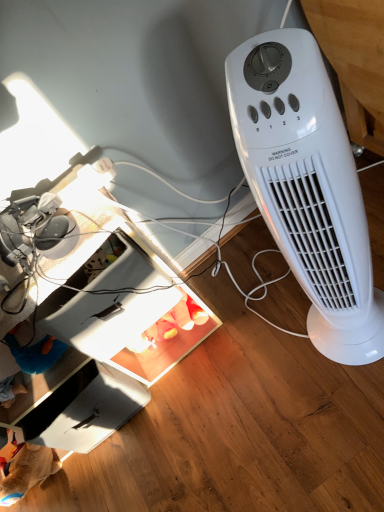
The image size is (384, 512). I want to click on vacant area that lies to the right of white plastic computer desk at lower left, so click(257, 332).